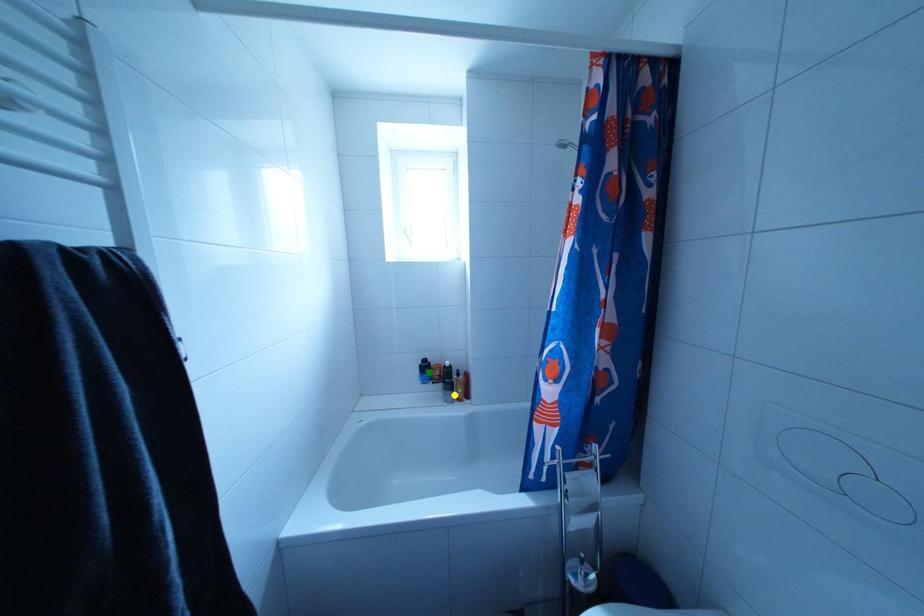
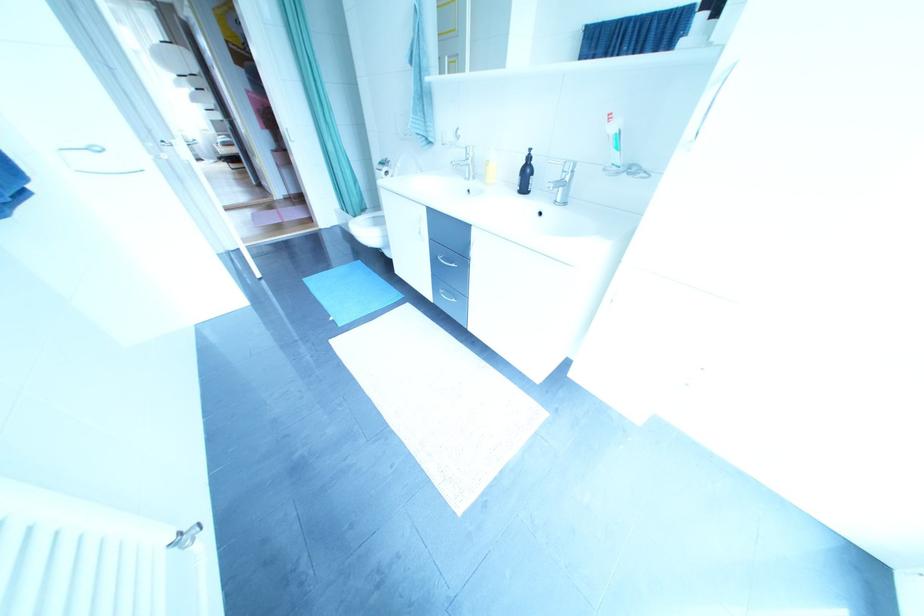
I am providing you with two images of the same scene from different viewpoints. Three points are marked in image1. Which point corresponds to a part or object that is occluded in image2?In image1, three points are marked. Which of them correspond to a part or object that is occluded in image2?Among the three points shown in image1, which one corresponds to a part or object that is no longer visible due to occlusion in image2?

blue point, yellow point, green point